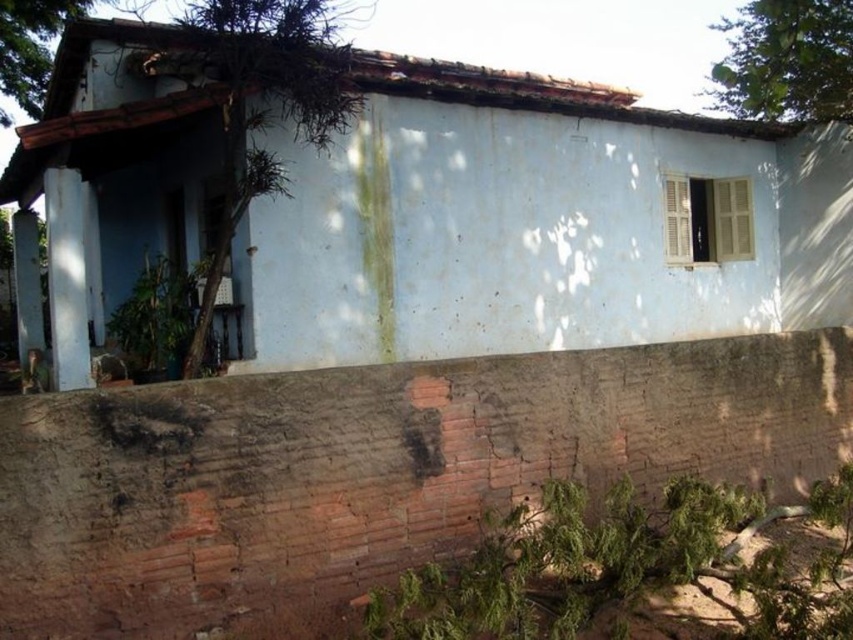
Can you confirm if white matte house at center is taller than green mossy roof at upper left?

→ Indeed, white matte house at center has a greater height compared to green mossy roof at upper left.

Which is in front, point (560, 124) or point (33, 68)?

Point (560, 124) is in front.

Where is `white matte house at center`? Image resolution: width=853 pixels, height=640 pixels. white matte house at center is located at coordinates (537, 224).

Who is positioned more to the right, white matte house at center or green leafy tree at upper right?

green leafy tree at upper right is more to the right.

Find the location of `white matte house at center`. white matte house at center is located at coordinates (537, 224).

Between green leafy tree at upper right and green mossy roof at upper left, which one has less height?

Standing shorter between the two is green mossy roof at upper left.

Can you confirm if green leafy tree at upper right is taller than green mossy roof at upper left?

Indeed, green leafy tree at upper right has a greater height compared to green mossy roof at upper left.

This screenshot has height=640, width=853. What do you see at coordinates (786, 60) in the screenshot?
I see `green leafy tree at upper right` at bounding box center [786, 60].

This screenshot has height=640, width=853. Find the location of `green leafy tree at upper right`. green leafy tree at upper right is located at coordinates (786, 60).